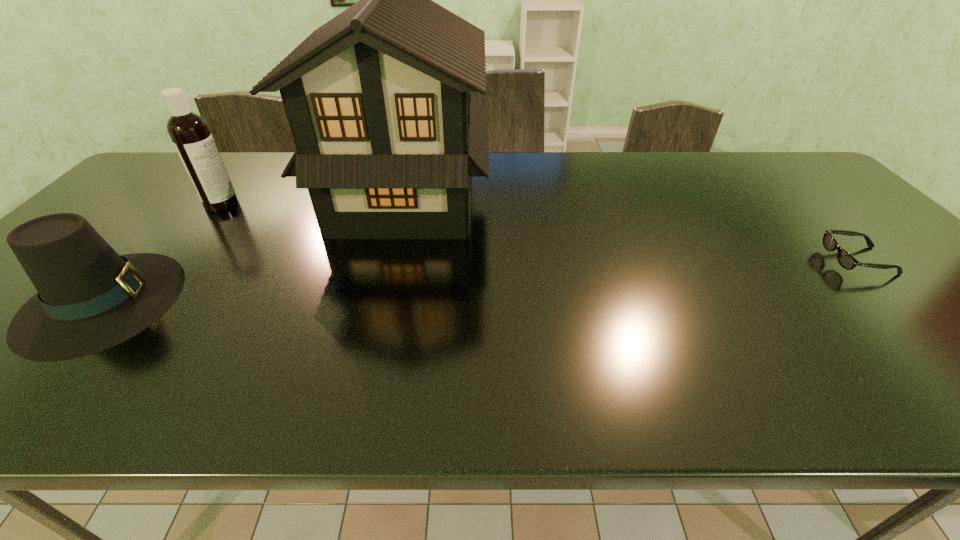
This screenshot has height=540, width=960. I want to click on dollhouse, so click(387, 134).

Where is `the tallest object`? Image resolution: width=960 pixels, height=540 pixels. the tallest object is located at coordinates (387, 134).

At what (x,y) coordinates should I click in order to perform the action: click on the third shortest object. Please return your answer as a coordinate pair (x, y). Looking at the image, I should click on (189, 132).

Image resolution: width=960 pixels, height=540 pixels. What are the coordinates of `spectacles` in the screenshot? It's located at (846, 260).

This screenshot has width=960, height=540. In order to click on the shortest object in this screenshot , I will do `click(846, 260)`.

Where is `free space located on the front-facing side of the dollhouse`? This screenshot has width=960, height=540. free space located on the front-facing side of the dollhouse is located at coordinates (591, 199).

The image size is (960, 540). I want to click on free location located 0.350m on the label side of the third shortest object, so click(x=355, y=204).

The height and width of the screenshot is (540, 960). In order to click on free location located 0.370m on the lenses of the shortest object in this screenshot , I will do `click(682, 261)`.

You are a GUI agent. You are given a task and a screenshot of the screen. Output one action in this format:
    pyautogui.click(x=<x>, y=<y>)
    Task: Click on the free space located on the lenses of the shortest object
    
    Given the screenshot: What is the action you would take?
    pyautogui.click(x=753, y=261)

I want to click on free space located 0.070m on the lenses of the shortest object, so click(x=801, y=261).